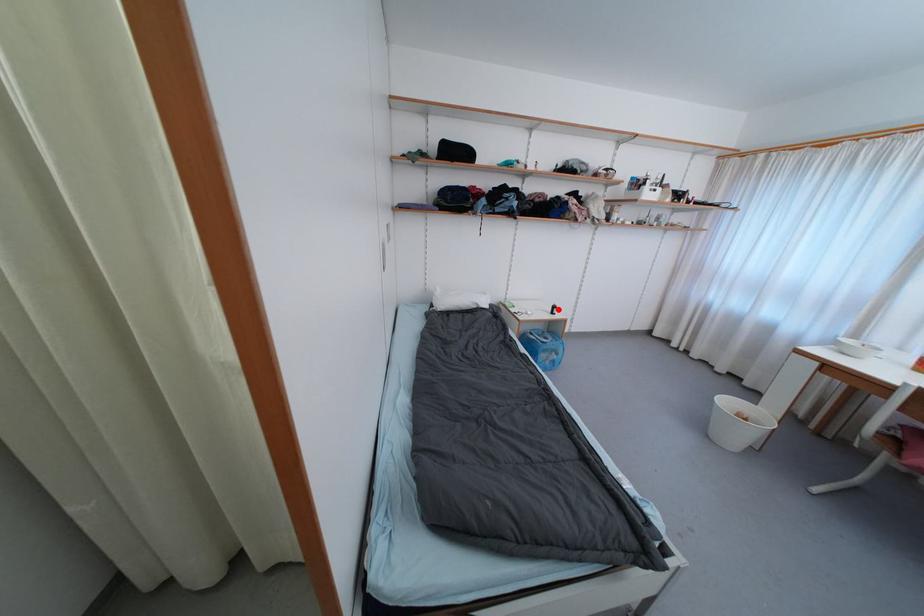
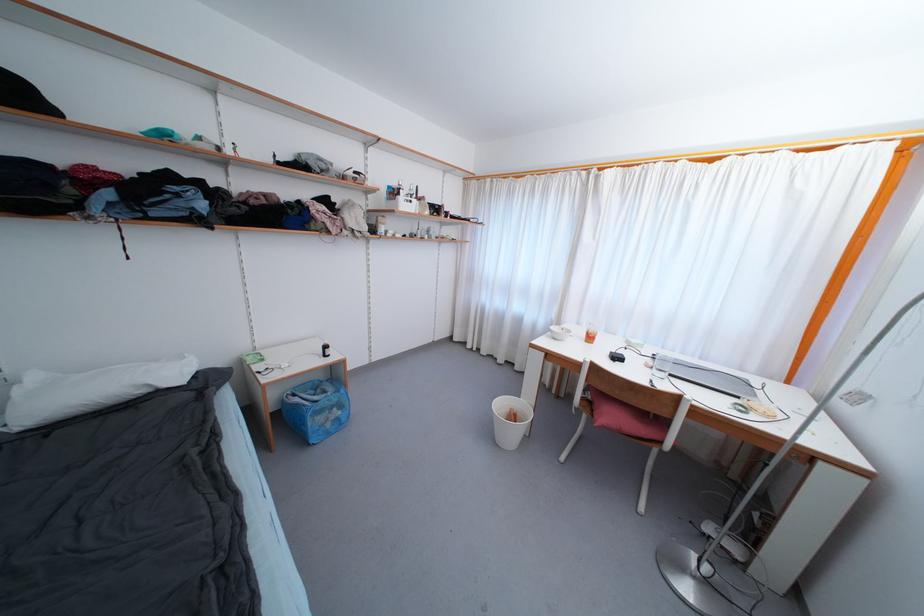
Question: I am providing you with two images of the same scene from different viewpoints. In image1, a red point is highlighted. Considering the same 3D point in image2, which of the following is correct?

Choices:
 (A) It is closer
 (B) It is farther

Answer: (A)